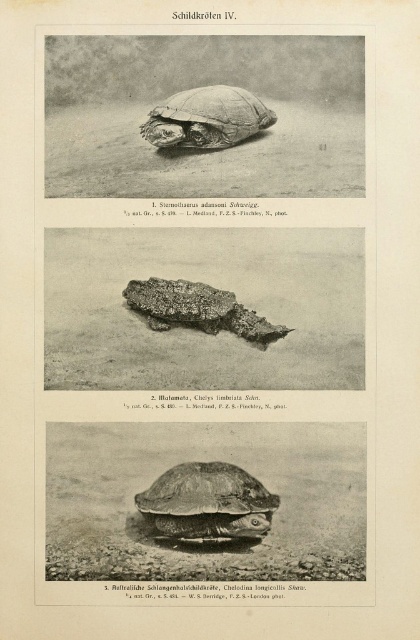
You are examining the top turtle image in the scientific publication. There are two points marked on the turtle shell at coordinates point (163, 120) and point (163, 296). Which of these points is closer to you?

Point (163, 120) is closer to the viewer than point (163, 296).

You are a researcher comparing two turtle features in the top image of a scientific page. You observe the brown textured shell at center and the rough textured tortoise at center. Which of these features is larger in size?

The brown textured shell at center is bigger than the rough textured tortoise at center.